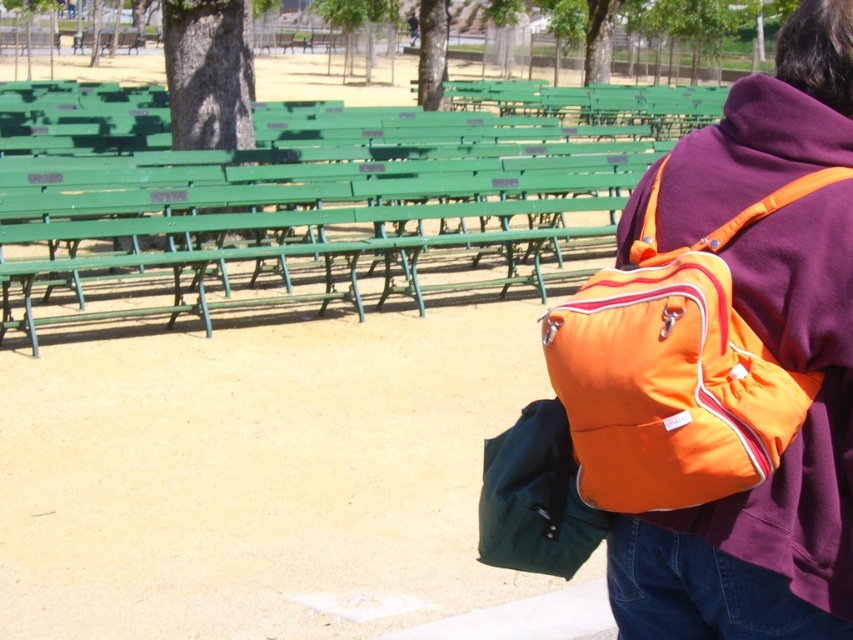
Can you confirm if green painted wood bench at center is positioned below matte green duffel bag at lower right?

No.

Which is more to the left, green painted wood bench at center or matte green duffel bag at lower right?

From the viewer's perspective, green painted wood bench at center appears more on the left side.

Identify the location of green painted wood bench at center. (332, 209).

Which is more to the right, orange nylon backpack at right or matte green duffel bag at lower right?

From the viewer's perspective, orange nylon backpack at right appears more on the right side.

Is orange nylon backpack at right smaller than matte green duffel bag at lower right?

Actually, orange nylon backpack at right might be larger than matte green duffel bag at lower right.

Is point (819, 195) closer to viewer compared to point (517, 435)?

Yes, it is.

Identify the location of orange nylon backpack at right. This screenshot has width=853, height=640. (775, 470).

Does green painted wood bench at center have a greater height compared to orange nylon backpack at right?

Indeed, green painted wood bench at center has a greater height compared to orange nylon backpack at right.

Does point (312, 284) come farther from viewer compared to point (695, 573)?

Yes, point (312, 284) is farther from viewer.

I want to click on green painted wood bench at center, so click(x=332, y=209).